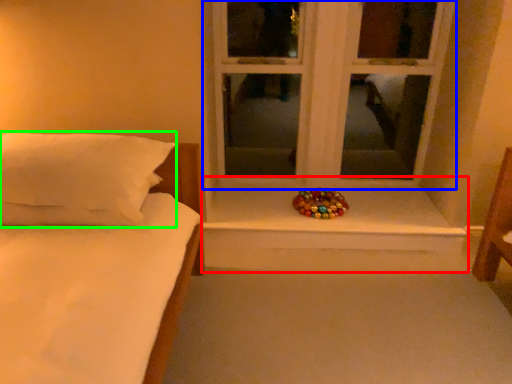
Question: Which object is positioned closest to window sill (highlighted by a red box)? Select from window (highlighted by a blue box) and pillow (highlighted by a green box).

Choices:
 (A) window
 (B) pillow

Answer: (A)